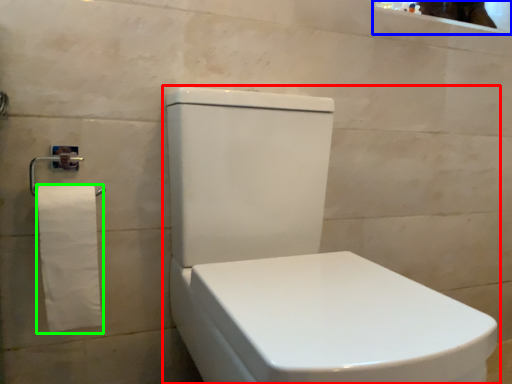
Question: Which is farther away from toilet (highlighted by a red box)? mirror (highlighted by a blue box) or toilet paper (highlighted by a green box)?

Choices:
 (A) mirror
 (B) toilet paper

Answer: (A)